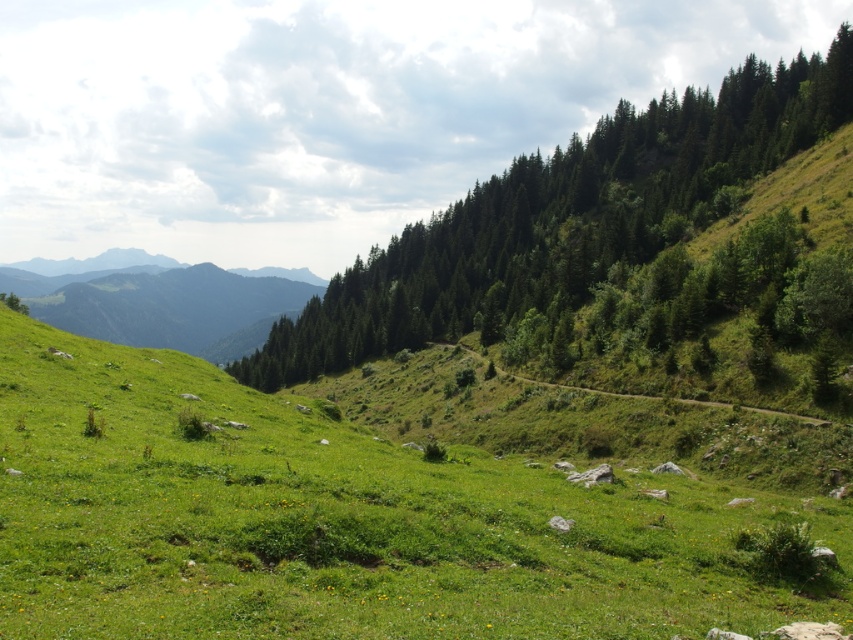
You are a hiker standing on the green grassy at center and want to reach the green textured trees at upper right. Which direction should you walk to get closer to the trees?

The green textured trees at upper right are located at the upper right of the scene, so you should walk towards the upper right direction to get closer to them.

From the picture: You are standing at the origin point of the coordinate system in this mountain landscape. The green grassy area is located at a specific coordinate. Can you tell me the exact coordinates of the green grassy at center?

The green grassy at center is located at the coordinates point of [339,522].